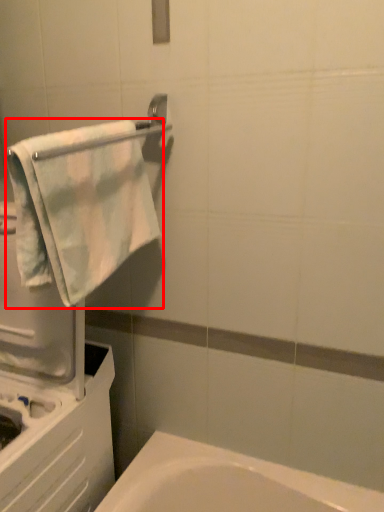
Question: From the image, what is the correct spatial relationship of towel (annotated by the red box) in relation to towel bar?

Choices:
 (A) left
 (B) right

Answer: (A)